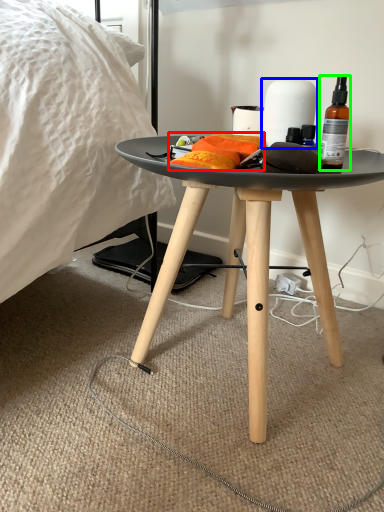
Question: Considering the real-world distances, which object is closest to material (highlighted by a red box)? paper towel (highlighted by a blue box) or bottle (highlighted by a green box).

Choices:
 (A) paper towel
 (B) bottle

Answer: (A)